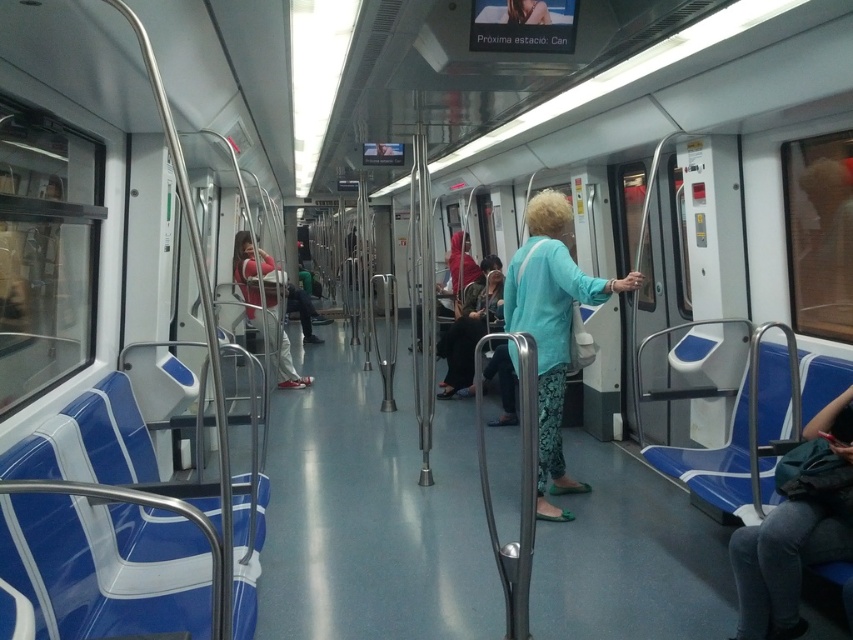
Is light blue fabric jacket at center below matte black crutches at center?

Yes, light blue fabric jacket at center is below matte black crutches at center.

What do you see at coordinates (550, 326) in the screenshot?
I see `light blue fabric jacket at center` at bounding box center [550, 326].

Between point (572, 278) and point (460, 305), which one is positioned in front?

Point (572, 278)

This screenshot has height=640, width=853. What are the coordinates of `light blue fabric jacket at center` in the screenshot? It's located at (550, 326).

Looking at this image, can you confirm if dark gray jeans at lower right is positioned to the right of light blue fabric jacket at center?

Yes, dark gray jeans at lower right is to the right of light blue fabric jacket at center.

What do you see at coordinates (795, 531) in the screenshot?
I see `dark gray jeans at lower right` at bounding box center [795, 531].

Which is in front, point (811, 525) or point (554, 467)?

Point (811, 525) is in front.

What are the coordinates of `dark gray jeans at lower right` in the screenshot? It's located at (795, 531).

Does matte black crutches at center appear under matte red shirt at center?

Yes.

Can you confirm if matte black crutches at center is wider than matte red shirt at center?

In fact, matte black crutches at center might be narrower than matte red shirt at center.

The width and height of the screenshot is (853, 640). Identify the location of matte black crutches at center. (469, 324).